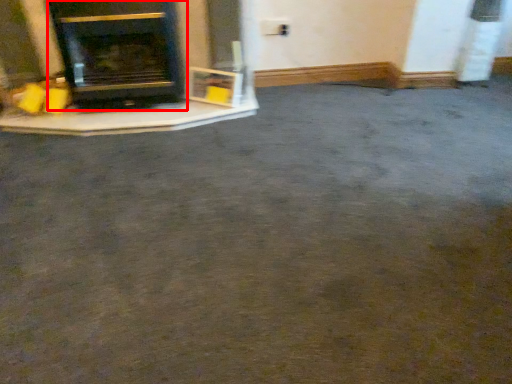
Question: From the image's perspective, what is the correct spatial relationship of wood burning stove (annotated by the red box) in relation to fireplace?

Choices:
 (A) above
 (B) below

Answer: (B)